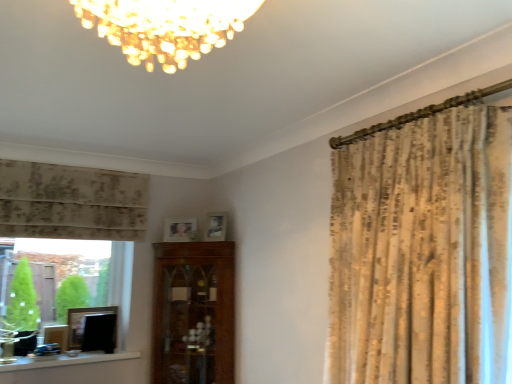
Question: Are matte wooden picture frame at upper center, which is the fourth picture frame in left-to-right order, and matte black picture frame at lower left, marked as the 3th picture frame in a top-to-bottom arrangement, far apart?

Choices:
 (A) no
 (B) yes

Answer: (A)

Question: Can you confirm if matte wooden picture frame at upper center, which is the fourth picture frame in left-to-right order, is wider than matte black picture frame at lower left, which appears as the second picture frame when viewed from the left?

Choices:
 (A) no
 (B) yes

Answer: (B)

Question: Is matte wooden picture frame at upper center, placed as the 4th picture frame when sorted from bottom to top, not within matte black picture frame at lower left, which appears as the second picture frame when viewed from the left?

Choices:
 (A) yes
 (B) no

Answer: (A)

Question: Is matte black picture frame at lower left, the 3th picture frame viewed from the right, surrounded by matte wooden picture frame at upper center, which is the fourth picture frame in left-to-right order?

Choices:
 (A) yes
 (B) no

Answer: (B)

Question: From a real-world perspective, is matte wooden picture frame at upper center, which is the fourth picture frame in left-to-right order, positioned over matte black picture frame at lower left, which appears as the second picture frame when viewed from the left, based on gravity?

Choices:
 (A) no
 (B) yes

Answer: (B)

Question: Does matte wooden picture frame at upper center, placed as the 4th picture frame when sorted from bottom to top, have a lesser height compared to matte black picture frame at lower left, which ranks as the 2th picture frame in bottom-to-top order?

Choices:
 (A) yes
 (B) no

Answer: (A)

Question: Considering the relative sizes of neutral floral fabric curtain at left and matte wooden picture frame at upper center, which is the 1th picture frame in right-to-left order, in the image provided, is neutral floral fabric curtain at left shorter than matte wooden picture frame at upper center, which is the 1th picture frame in right-to-left order,?

Choices:
 (A) no
 (B) yes

Answer: (A)

Question: Is neutral floral fabric curtain at left bigger than matte wooden picture frame at upper center, the 1th picture frame in the top-to-bottom sequence?

Choices:
 (A) no
 (B) yes

Answer: (B)

Question: From a real-world perspective, is neutral floral fabric curtain at left positioned over matte wooden picture frame at upper center, placed as the 4th picture frame when sorted from bottom to top, based on gravity?

Choices:
 (A) yes
 (B) no

Answer: (A)

Question: From a real-world perspective, does neutral floral fabric curtain at left sit lower than matte wooden picture frame at upper center, the 1th picture frame in the top-to-bottom sequence?

Choices:
 (A) yes
 (B) no

Answer: (B)

Question: Is neutral floral fabric curtain at left taller than matte wooden picture frame at upper center, which is the fourth picture frame in left-to-right order?

Choices:
 (A) yes
 (B) no

Answer: (A)

Question: Is the depth of neutral floral fabric curtain at left less than that of matte wooden picture frame at upper center, the 1th picture frame in the top-to-bottom sequence?

Choices:
 (A) no
 (B) yes

Answer: (B)

Question: Does matte wooden picture frame at center, the second picture frame from the top, come in front of neutral floral fabric curtain at left?

Choices:
 (A) yes
 (B) no

Answer: (B)